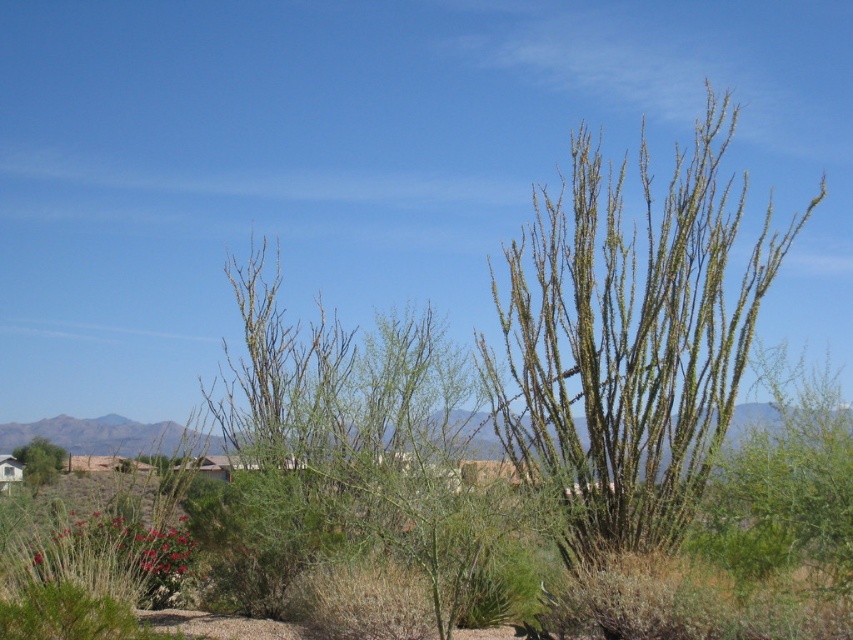
Is green spiny bush at center bigger than green spiny bush at lower left?

Actually, green spiny bush at center might be smaller than green spiny bush at lower left.

Is green spiny bush at center behind green spiny bush at lower left?

No, it is in front of green spiny bush at lower left.

This screenshot has width=853, height=640. What do you see at coordinates (628, 339) in the screenshot? I see `green spiny bush at center` at bounding box center [628, 339].

You are a GUI agent. You are given a task and a screenshot of the screen. Output one action in this format:
    pyautogui.click(x=<x>, y=<y>)
    Task: Click on the green spiny bush at center
    The width and height of the screenshot is (853, 640).
    Given the screenshot: What is the action you would take?
    pyautogui.click(x=628, y=339)